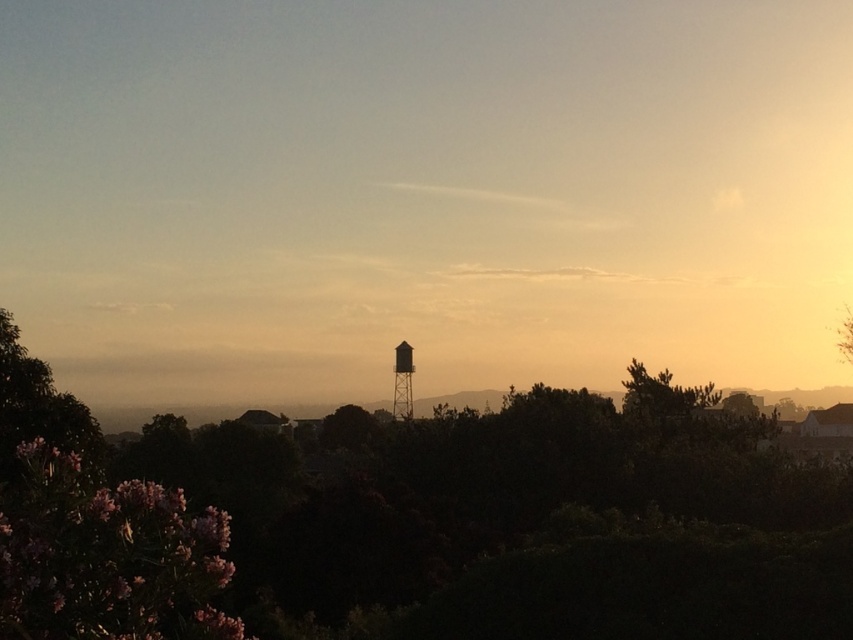
Question: Is the position of pink matte flowers at lower left more distant than that of metallic water tower at center?

Choices:
 (A) yes
 (B) no

Answer: (B)

Question: In this image, where is silvery metallic water tower at center located relative to metallic water tower at center?

Choices:
 (A) right
 (B) left

Answer: (A)

Question: Observing the image, what is the correct spatial positioning of green matte tree at center in reference to silvery metallic water tower at center?

Choices:
 (A) left
 (B) right

Answer: (B)

Question: Which object appears closest to the camera in this image?

Choices:
 (A) silvery metallic water tower at center
 (B) metallic water tower at center

Answer: (A)

Question: Which of these objects is positioned closest to the green matte tree at center?

Choices:
 (A) pink matte flowers at lower left
 (B) metallic water tower at center
 (C) silvery metallic water tower at center

Answer: (C)

Question: Among these points, which one is farthest from the camera?

Choices:
 (A) (51, 589)
 (B) (393, 392)

Answer: (B)